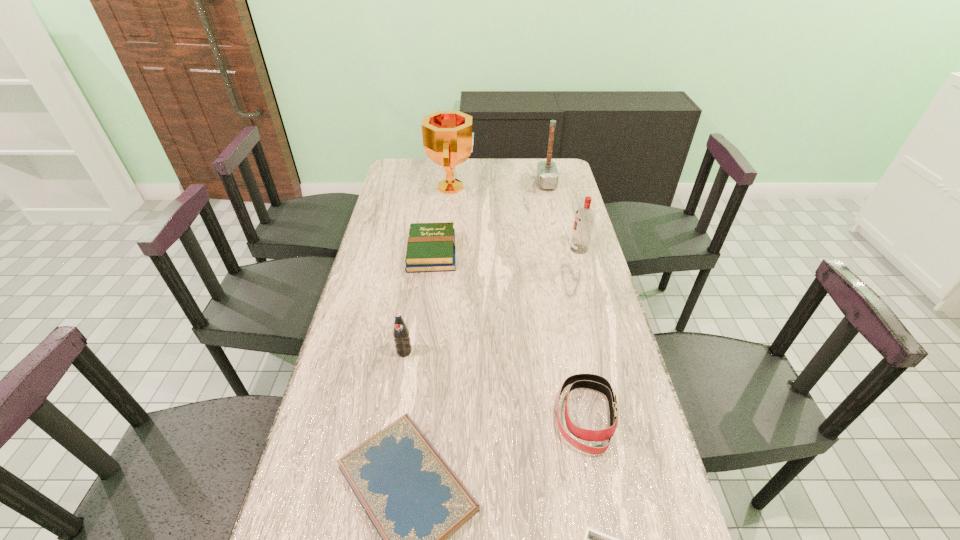
Locate an element on the screen. Image resolution: width=960 pixels, height=540 pixels. object that is at the left edge is located at coordinates (431, 247).

The height and width of the screenshot is (540, 960). In order to click on hammer at the right edge in this screenshot , I will do `click(547, 174)`.

Where is `vodka that is positioned at the right edge`? This screenshot has width=960, height=540. vodka that is positioned at the right edge is located at coordinates (584, 217).

At what (x,y) coordinates should I click in order to perform the action: click on dog collar present at the right edge. Please return your answer as a coordinate pair (x, y). Looking at the image, I should click on (590, 381).

Where is `object that is at the far right corner`? object that is at the far right corner is located at coordinates point(547,174).

Locate an element on the screen. This screenshot has width=960, height=540. blank space at the left edge is located at coordinates (371, 303).

At what (x,y) coordinates should I click in order to perform the action: click on vacant space at the right edge of the desktop. Please return your answer as a coordinate pair (x, y). Looking at the image, I should click on (569, 249).

Locate an element on the screen. The width and height of the screenshot is (960, 540). free region at the far left corner is located at coordinates (396, 178).

At what (x,y) coordinates should I click in order to perform the action: click on blank region between the hammer and the vodka. Please return your answer as a coordinate pair (x, y). Looking at the image, I should click on (563, 216).

At what (x,y) coordinates should I click in order to perform the action: click on vacant point located between the sixth shortest object and the award. Please return your answer as a coordinate pair (x, y). Image resolution: width=960 pixels, height=540 pixels. Looking at the image, I should click on (516, 218).